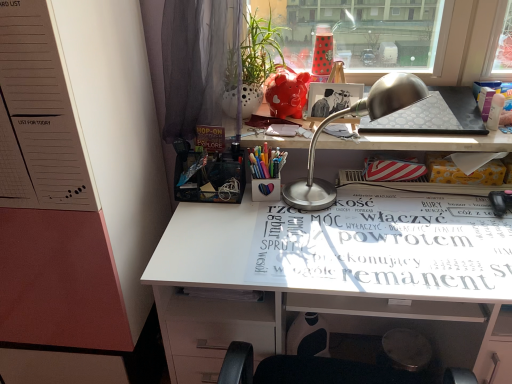
This screenshot has width=512, height=384. In order to click on free space to the left of translucent plastic bottle at upper right, marked as the 1th stationery in a top-to-bottom arrangement in this screenshot , I will do `click(456, 131)`.